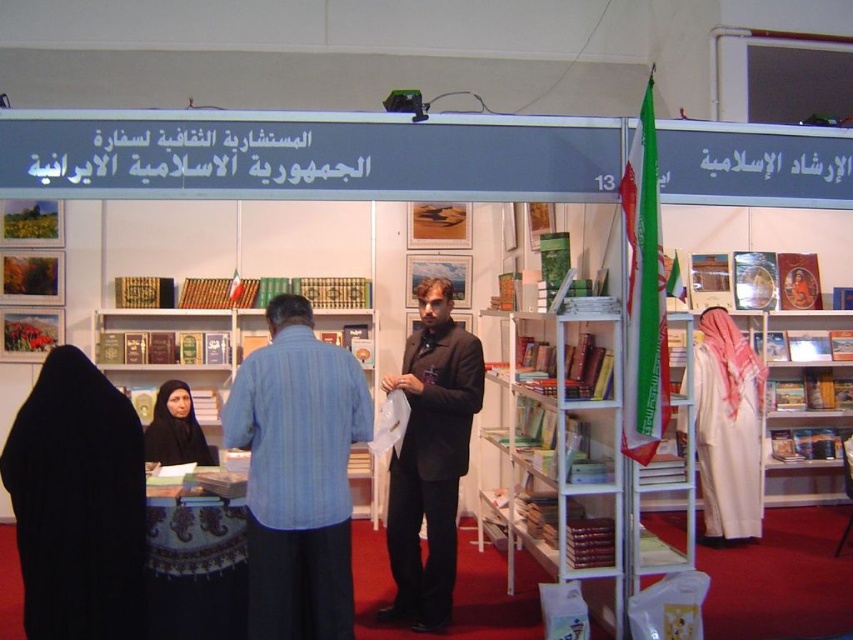
From the picture: You are standing at the viewer position in the booth. There is a point at coordinate (271,422). If you want to place a 3 meter long banner between you and that point, will it fit?

The distance between the viewer and the point at (271,422) is 2.72 meters. Since the banner is 3 meters long, it is longer than the available space. Therefore, the banner will not fit between the viewer and the point at (271,422).

In the scene shown: You are an event organizer who needs to place a new 1.2 meter wide display stand between the white metal bookshelf at center and the black fabric headscarf at center. Based on their widths, can the display stand fit in the space between them?

The white metal bookshelf at center is wider than the black fabric headscarf at center. However, since the exact widths are not provided, it is not possible to determine if the 1.2 meter wide display stand can fit between them.

You are at the event and want to approach the person wearing the blue striped shirt at center and the black fabric headscarf at center. Which one should you walk towards if you want to greet the person on the right side first?

You should walk towards the blue striped shirt at center first because it is positioned on the right side of the black fabric headscarf at center, making it the one on the right.